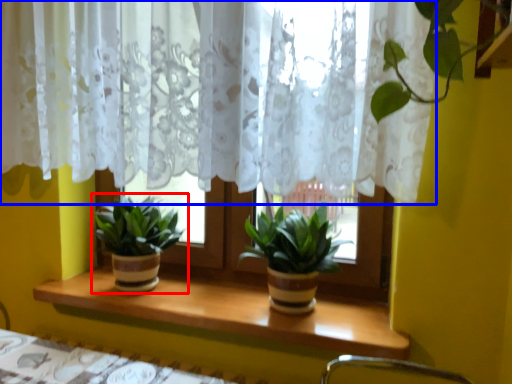
Question: Which point is further to the camera, houseplant (highlighted by a red box) or curtain (highlighted by a blue box)?

Choices:
 (A) houseplant
 (B) curtain

Answer: (A)